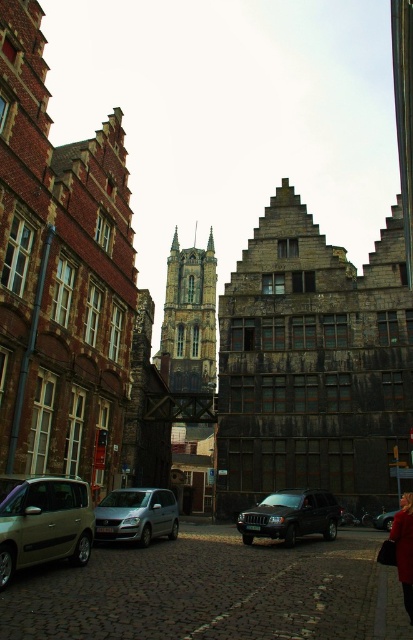
Question: Estimate the real-world distances between objects in this image. Which object is farther from the metallic silver suv at lower right?

Choices:
 (A) black matte suv at center
 (B) silver metallic van at center
 (C) stone gothic tower at center

Answer: (C)

Question: Which of the following is the farthest from the observer?

Choices:
 (A) (394, 512)
 (B) (242, 518)

Answer: (A)

Question: Which point is farther from the camera taking this photo?

Choices:
 (A) (28, 515)
 (B) (401, 500)
 (C) (247, 536)

Answer: (B)

Question: Can you confirm if silver metallic van at center is positioned below metallic silver suv at lower right?

Choices:
 (A) yes
 (B) no

Answer: (B)

Question: In this image, where is gold metallic van at lower left located relative to silver metallic van at center?

Choices:
 (A) right
 (B) left

Answer: (B)

Question: Can you confirm if gold metallic van at lower left is positioned below stone gothic tower at center?

Choices:
 (A) no
 (B) yes

Answer: (B)